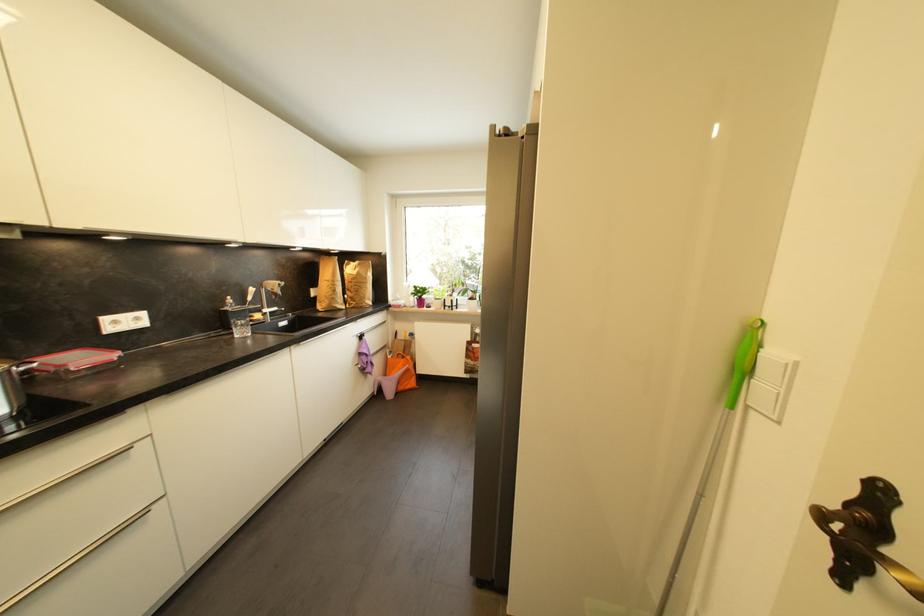
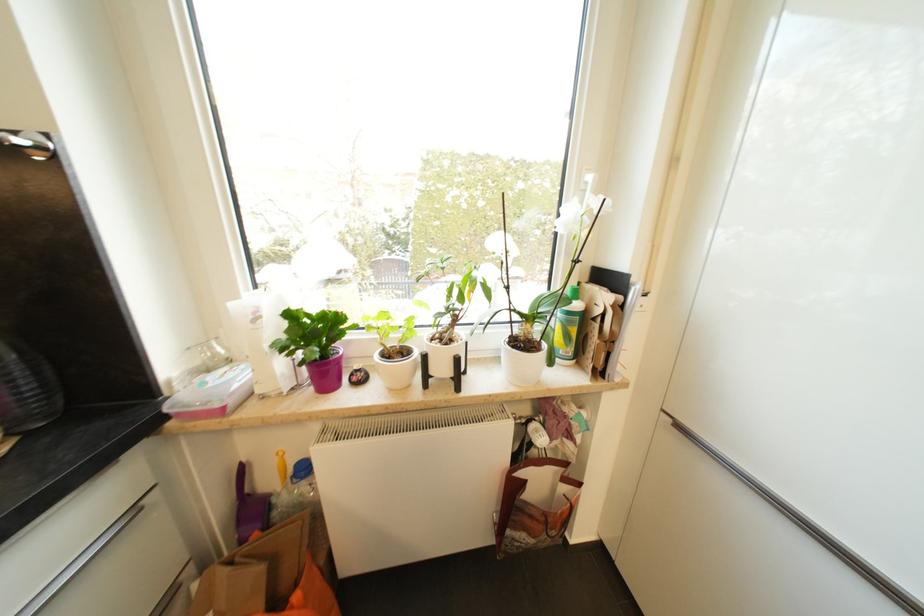
The point at (454, 305) is marked in the first image. Where is the corresponding point in the second image?

(446, 371)